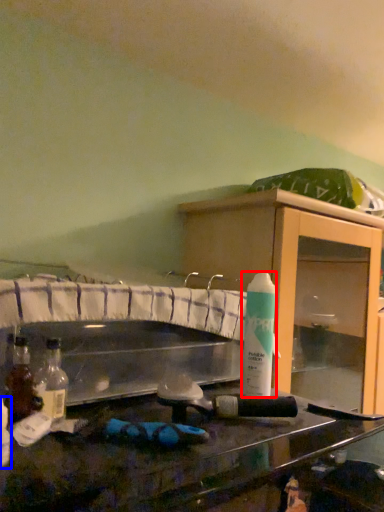
Question: Which point is closer to the camera, cleaning product (highlighted by a red box) or bottle (highlighted by a blue box)?

Choices:
 (A) cleaning product
 (B) bottle

Answer: (B)